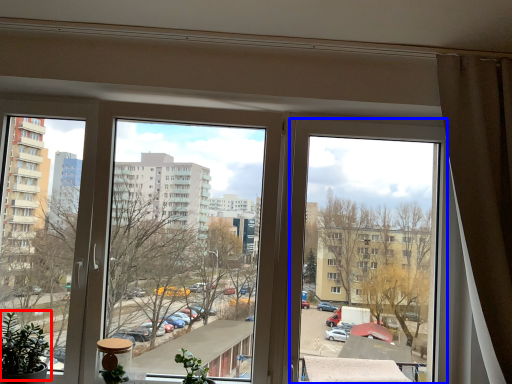
Question: Which object is further to the camera taking this photo, plant (highlighted by a red box) or window (highlighted by a blue box)?

Choices:
 (A) plant
 (B) window

Answer: (B)